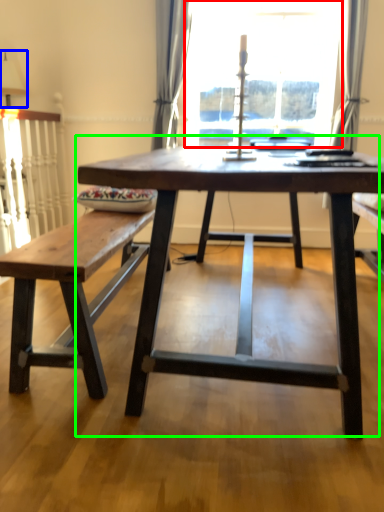
Question: Based on their relative distances, which object is farther from window screen (highlighted by a red box)? Choose from table lamp (highlighted by a blue box) and coffee table (highlighted by a green box).

Choices:
 (A) table lamp
 (B) coffee table

Answer: (B)